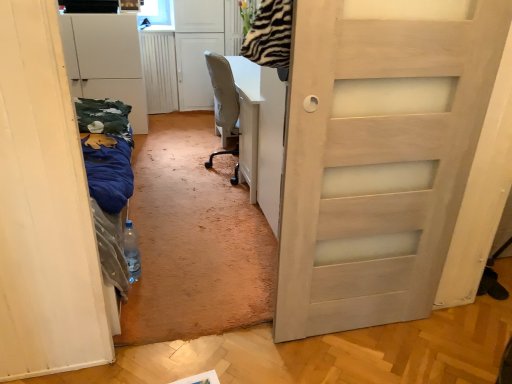
Question: Considering their positions, is white matte cabinet at left located in front of or behind translucent plastic bottle at center?

Choices:
 (A) behind
 (B) front

Answer: (A)

Question: From the image's perspective, relative to translucent plastic bottle at center, is white matte cabinet at left above or below?

Choices:
 (A) above
 (B) below

Answer: (A)

Question: Estimate the real-world distances between objects in this image. Which object is farther from the white matte door at left?

Choices:
 (A) translucent plastic bottle at center
 (B) white matte cabinet at left

Answer: (B)

Question: Which object is positioned farthest from the white matte cabinet at left?

Choices:
 (A) white matte door at left
 (B) translucent plastic bottle at center

Answer: (A)